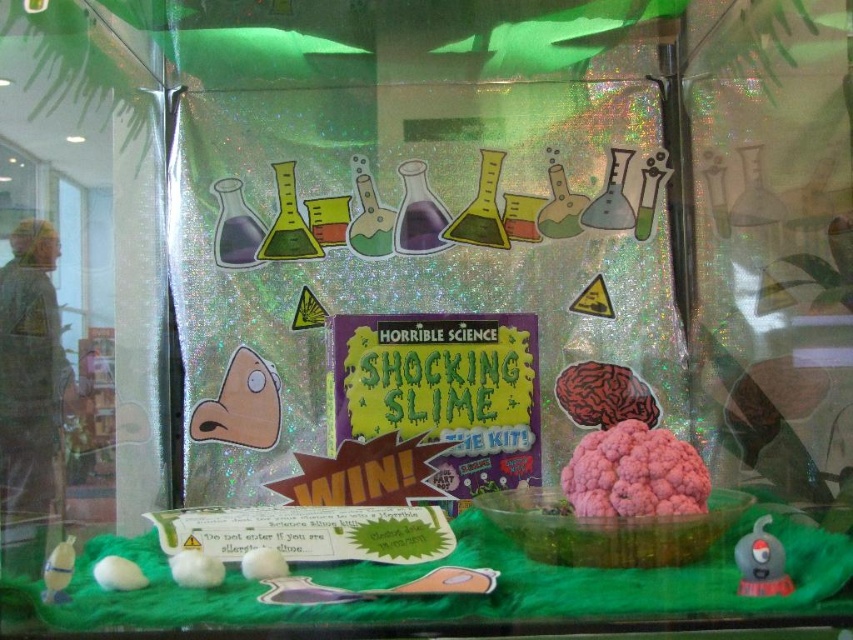
Is holographic plastic box at center bigger than green matte poster at center?

Yes, holographic plastic box at center is bigger than green matte poster at center.

Locate an element on the screen. Image resolution: width=853 pixels, height=640 pixels. holographic plastic box at center is located at coordinates (421, 278).